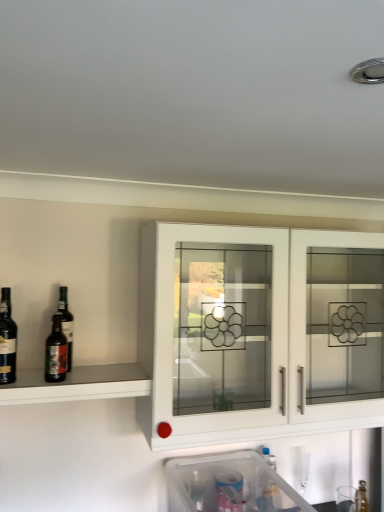
Question: Is clear glass bottle at lower right inside or outside of white glossy cabinet at center?

Choices:
 (A) outside
 (B) inside

Answer: (A)

Question: Is point (355, 498) closer or farther from the camera than point (144, 418)?

Choices:
 (A) farther
 (B) closer

Answer: (A)

Question: Which object is positioned closest to the dark brown glass bottle at left, arranged as the first wine when viewed from the right?

Choices:
 (A) matte glass shelf at left
 (B) dark brown glass bottle at left, placed as the first wine when sorted from left to right
 (C) clear plastic container at lower center
 (D) clear glass bottle at lower right
 (E) white glossy cabinet at center

Answer: (A)

Question: Which is nearer to the white glossy cabinet at center?

Choices:
 (A) clear glass bottle at lower right
 (B) matte glass shelf at left
 (C) dark brown glass bottle at left, arranged as the first wine when viewed from the right
 (D) dark brown glass bottle at left, placed as the first wine when sorted from left to right
 (E) clear plastic container at lower center

Answer: (B)